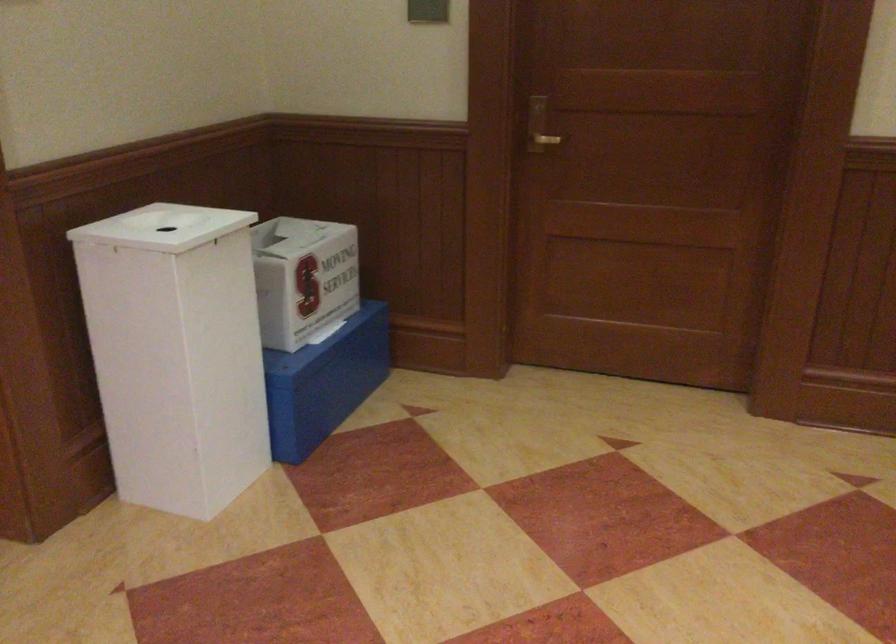
Where is `white bin lid`? white bin lid is located at coordinates (164, 227).